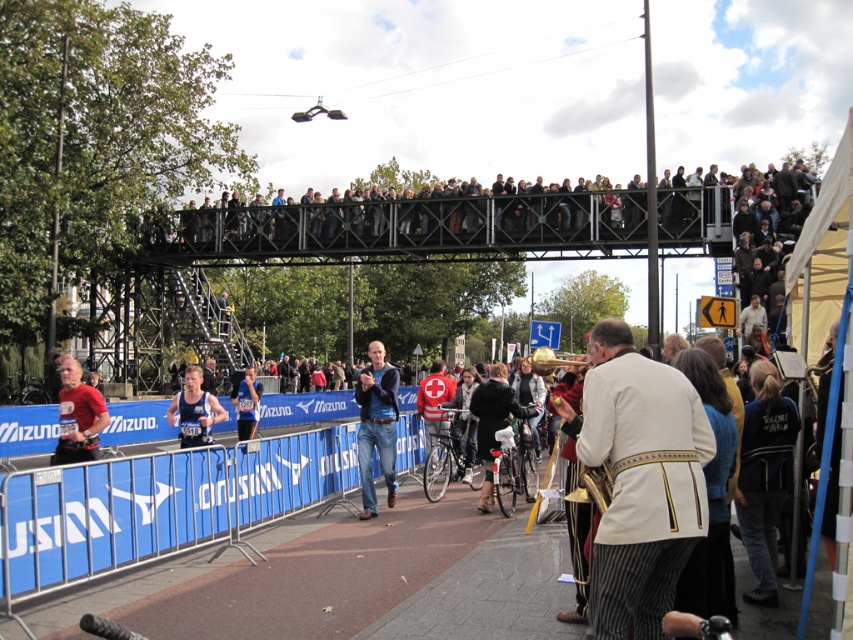
Question: Considering the relative positions of blue fabric barrier at lower left and metallic gray crowd at upper center in the image provided, where is blue fabric barrier at lower left located with respect to metallic gray crowd at upper center?

Choices:
 (A) above
 (B) below

Answer: (B)

Question: Which object is farther from the camera taking this photo?

Choices:
 (A) metallic gray crowd at upper center
 (B) matte blue shirt at center

Answer: (A)

Question: Among these points, which one is farthest from the camera?

Choices:
 (A) (102, 419)
 (B) (787, 468)

Answer: (A)

Question: Which point is farther from the camera taking this photo?

Choices:
 (A) (19, 589)
 (B) (775, 394)
 (C) (360, 451)

Answer: (C)

Question: Does blue fabric barrier at lower left appear on the left side of white fabric coat at center-right?

Choices:
 (A) no
 (B) yes

Answer: (B)

Question: Is blue fabric barrier at lower left positioned behind blue athletic wear at center?

Choices:
 (A) no
 (B) yes

Answer: (A)